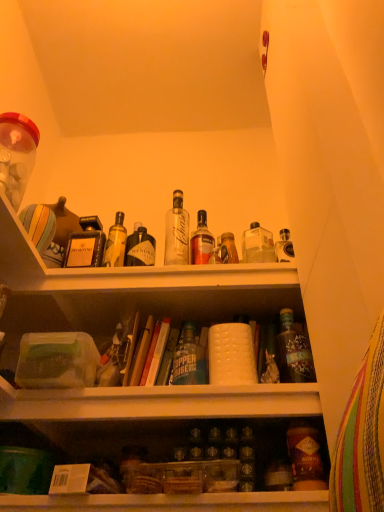
Question: Considering the relative sizes of translucent glass bottle at center, the 3th bottle when ordered from right to left, and hardcover book at center, positioned as the 2th book in left-to-right order, in the image provided, is translucent glass bottle at center, the 3th bottle when ordered from right to left, taller than hardcover book at center, positioned as the 2th book in left-to-right order,?

Choices:
 (A) no
 (B) yes

Answer: (A)

Question: Is the depth of translucent glass bottle at center, the 3th bottle when ordered from right to left, less than that of hardcover book at center, positioned as the 2th book in left-to-right order?

Choices:
 (A) no
 (B) yes

Answer: (A)

Question: Is the depth of translucent glass bottle at center, the third bottle in the left-to-right sequence, greater than that of hardcover book at center, the 1th book viewed from the right?

Choices:
 (A) no
 (B) yes

Answer: (B)

Question: Is translucent glass bottle at center, the 3th bottle when ordered from right to left, oriented towards hardcover book at center, positioned as the 2th book in left-to-right order?

Choices:
 (A) yes
 (B) no

Answer: (B)

Question: Are translucent glass bottle at center, the 3th bottle when ordered from right to left, and hardcover book at center, the 1th book viewed from the right, far apart?

Choices:
 (A) no
 (B) yes

Answer: (A)

Question: From the image's perspective, would you say translucent glass bottle at center, the third bottle in the left-to-right sequence, is positioned over hardcover book at center, the 1th book viewed from the right?

Choices:
 (A) yes
 (B) no

Answer: (A)

Question: From the image's perspective, would you say clear glass bottle at center, which ranks as the 5th bottle in right-to-left order, is shown under translucent glass bottle at center, the 3th bottle when ordered from right to left?

Choices:
 (A) no
 (B) yes

Answer: (A)

Question: Is clear glass bottle at center, placed as the first bottle when sorted from left to right, beside translucent glass bottle at center, the third bottle in the left-to-right sequence?

Choices:
 (A) yes
 (B) no

Answer: (B)

Question: Does clear glass bottle at center, placed as the first bottle when sorted from left to right, contain translucent glass bottle at center, the third bottle in the left-to-right sequence?

Choices:
 (A) no
 (B) yes

Answer: (A)

Question: Can you confirm if clear glass bottle at center, placed as the first bottle when sorted from left to right, is wider than translucent glass bottle at center, the 3th bottle when ordered from right to left?

Choices:
 (A) no
 (B) yes

Answer: (B)

Question: Can you confirm if clear glass bottle at center, placed as the first bottle when sorted from left to right, is shorter than translucent glass bottle at center, the third bottle in the left-to-right sequence?

Choices:
 (A) no
 (B) yes

Answer: (A)

Question: Can you confirm if clear glass bottle at center, placed as the first bottle when sorted from left to right, is taller than translucent glass bottle at center, the third bottle in the left-to-right sequence?

Choices:
 (A) no
 (B) yes

Answer: (B)

Question: From the image's perspective, does clear glass bottle at center, placed as the first bottle when sorted from left to right, appear lower than matte brown bottle at lower right, arranged as the fourth bottle when viewed from the left?

Choices:
 (A) no
 (B) yes

Answer: (A)